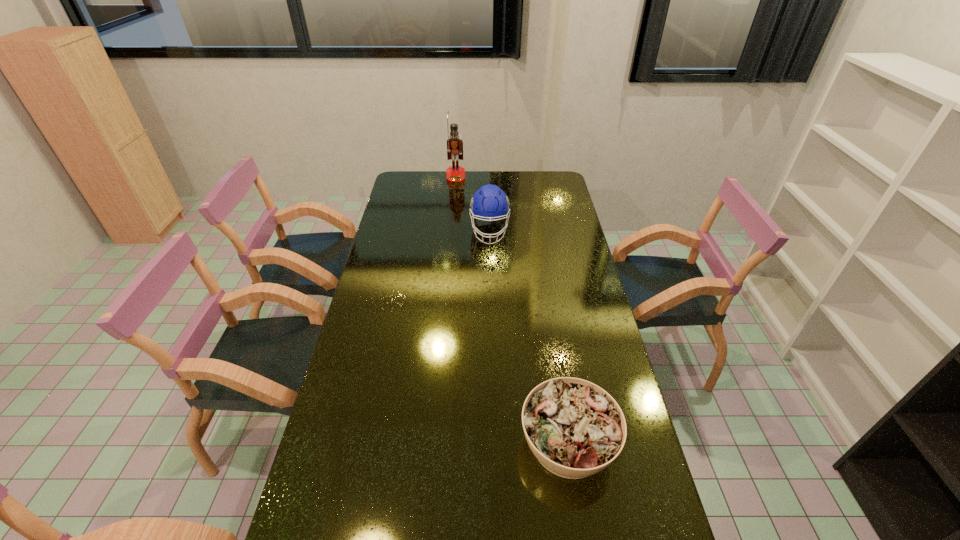
Where is `object that is at the right edge`? This screenshot has width=960, height=540. object that is at the right edge is located at coordinates point(575,429).

This screenshot has width=960, height=540. In the image, there is a desktop. Find the location of `vacant space at the far edge`. vacant space at the far edge is located at coordinates (490, 172).

Find the location of a particular element. free space at the left edge of the desktop is located at coordinates (414, 224).

I want to click on free location at the right edge, so click(x=588, y=322).

Where is `vacant region at the far right corner of the desktop`? Image resolution: width=960 pixels, height=540 pixels. vacant region at the far right corner of the desktop is located at coordinates (560, 186).

The width and height of the screenshot is (960, 540). Find the location of `free space between the second farthest object and the nearest object`. free space between the second farthest object and the nearest object is located at coordinates (529, 336).

Identify the location of free space between the nutcracker and the salad. (512, 310).

This screenshot has width=960, height=540. Identify the location of vacant area that lies between the nearest object and the nutcracker. [512, 310].

Where is `vacant point located between the salad and the second farthest object`? vacant point located between the salad and the second farthest object is located at coordinates (529, 336).

Identify which object is the second closest to the nutcracker. Please provide its 2D coordinates. Your answer should be formatted as a tuple, i.e. [(x, y)], where the tuple contains the x and y coordinates of a point satisfying the conditions above.

[(575, 429)]